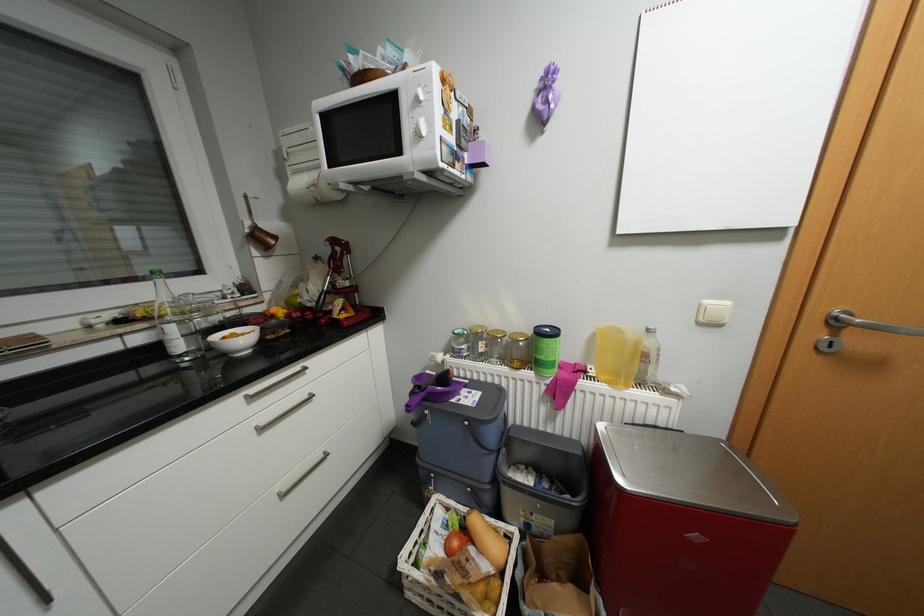
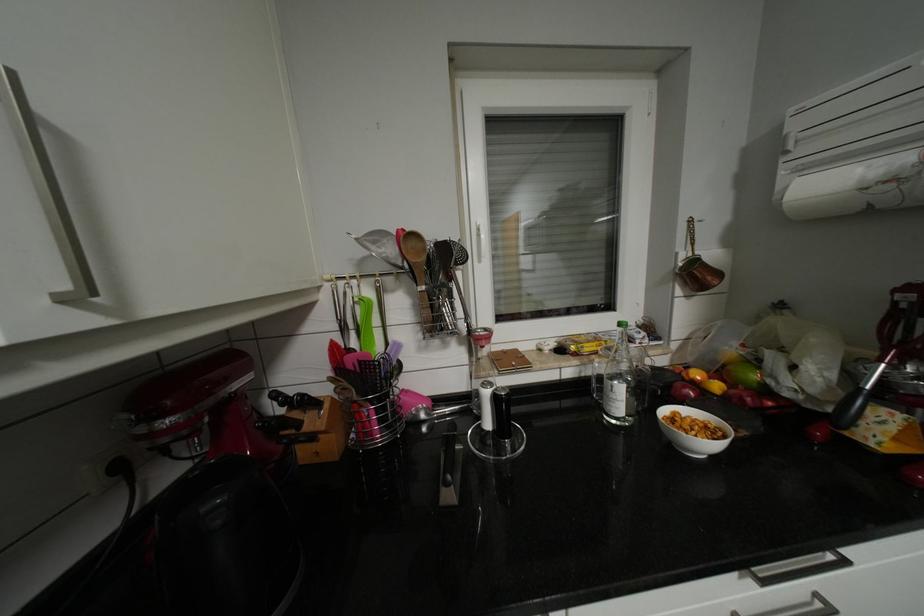
The point at (288, 312) is marked in the first image. Where is the corresponding point in the second image?

(724, 386)